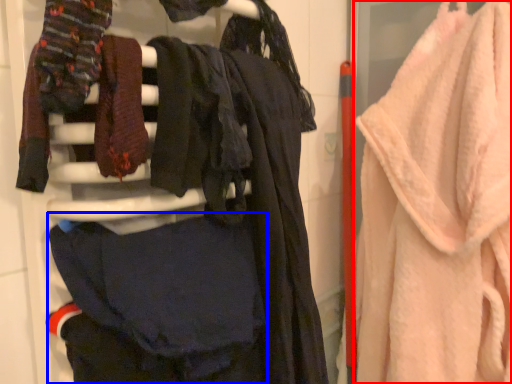
Question: Which of the following is the closest to the observer, towel (highlighted by a red box) or clothing (highlighted by a blue box)?

Choices:
 (A) towel
 (B) clothing

Answer: (B)